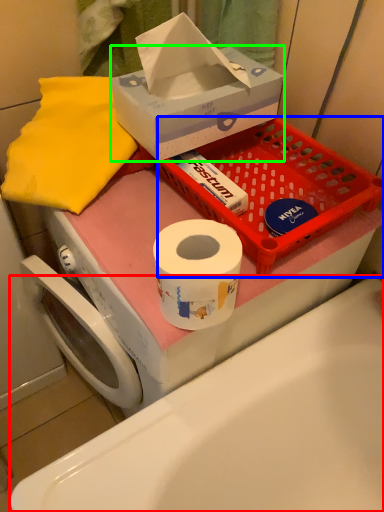
Question: Which is farther away from bath (highlighted by a red box)? basket (highlighted by a blue box) or box (highlighted by a green box)?

Choices:
 (A) basket
 (B) box

Answer: (B)